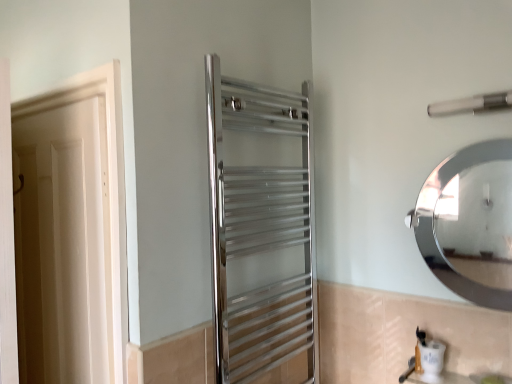
Question: From the image's perspective, is polished chrome towel rack at center, placed as the 1th screen door when sorted from right to left, located above white wood screen door at left, the second screen door from the right?

Choices:
 (A) no
 (B) yes

Answer: (B)

Question: Does polished chrome towel rack at center, placed as the 1th screen door when sorted from right to left, have a smaller size compared to white wood screen door at left, arranged as the 1th screen door when viewed from the left?

Choices:
 (A) yes
 (B) no

Answer: (B)

Question: Could you tell me if polished chrome towel rack at center, placed as the 1th screen door when sorted from right to left, is turned towards white wood screen door at left, arranged as the 1th screen door when viewed from the left?

Choices:
 (A) no
 (B) yes

Answer: (A)

Question: Is polished chrome towel rack at center, the second screen door positioned from the left, next to white wood screen door at left, arranged as the 1th screen door when viewed from the left, and touching it?

Choices:
 (A) yes
 (B) no

Answer: (B)

Question: Is polished chrome towel rack at center, the second screen door positioned from the left, at the left side of white wood screen door at left, the second screen door from the right?

Choices:
 (A) no
 (B) yes

Answer: (A)

Question: Considering the relative sizes of polished chrome towel rack at center, the second screen door positioned from the left, and white wood screen door at left, arranged as the 1th screen door when viewed from the left, in the image provided, is polished chrome towel rack at center, the second screen door positioned from the left, wider than white wood screen door at left, arranged as the 1th screen door when viewed from the left,?

Choices:
 (A) yes
 (B) no

Answer: (A)

Question: From the image's perspective, is satin nickel towel bar at upper right over white wood screen door at left, arranged as the 1th screen door when viewed from the left?

Choices:
 (A) yes
 (B) no

Answer: (A)

Question: Could white wood screen door at left, arranged as the 1th screen door when viewed from the left, be considered to be inside satin nickel towel bar at upper right?

Choices:
 (A) no
 (B) yes

Answer: (A)

Question: Considering the relative sizes of satin nickel towel bar at upper right and white wood screen door at left, arranged as the 1th screen door when viewed from the left, in the image provided, is satin nickel towel bar at upper right wider than white wood screen door at left, arranged as the 1th screen door when viewed from the left,?

Choices:
 (A) yes
 (B) no

Answer: (A)

Question: Considering the relative sizes of satin nickel towel bar at upper right and white wood screen door at left, the second screen door from the right, in the image provided, is satin nickel towel bar at upper right bigger than white wood screen door at left, the second screen door from the right,?

Choices:
 (A) yes
 (B) no

Answer: (B)

Question: From a real-world perspective, is satin nickel towel bar at upper right under white wood screen door at left, the second screen door from the right?

Choices:
 (A) no
 (B) yes

Answer: (A)

Question: Is satin nickel towel bar at upper right at the left side of white wood screen door at left, arranged as the 1th screen door when viewed from the left?

Choices:
 (A) yes
 (B) no

Answer: (B)

Question: From a real-world perspective, is polished chrome towel rack at center, placed as the 1th screen door when sorted from right to left, beneath white matte door at left?

Choices:
 (A) yes
 (B) no

Answer: (B)